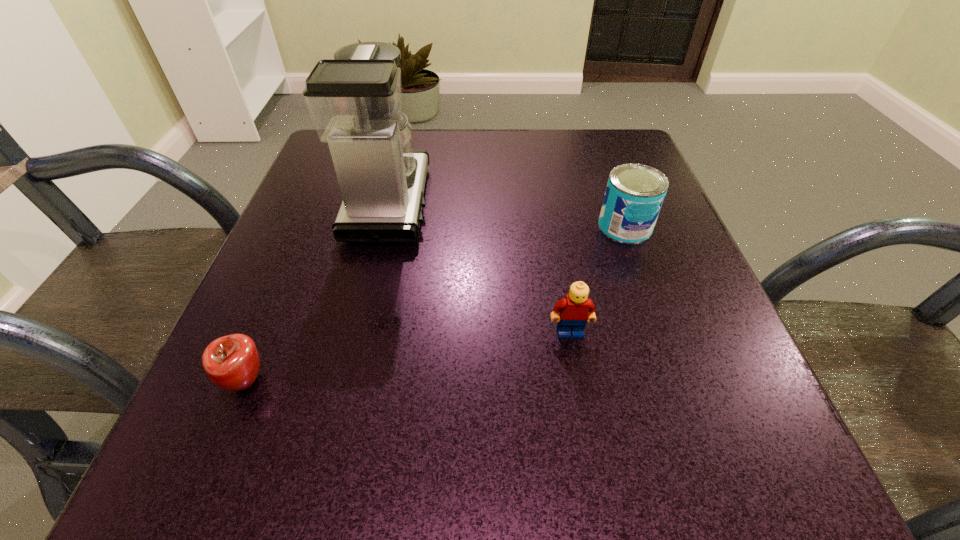
You are a GUI agent. You are given a task and a screenshot of the screen. Output one action in this format:
    pyautogui.click(x=<x>, y=<y>)
    Task: Click on the vacant space situated on the right of the leftmost object
    The height and width of the screenshot is (540, 960).
    Given the screenshot: What is the action you would take?
    pyautogui.click(x=399, y=381)

Where is `object that is at the far edge`? The width and height of the screenshot is (960, 540). object that is at the far edge is located at coordinates point(355,100).

The width and height of the screenshot is (960, 540). Identify the location of coffee maker that is at the left edge. (355, 100).

The image size is (960, 540). Find the location of `apple at the left edge`. apple at the left edge is located at coordinates (231, 362).

Where is `object present at the right edge`? The image size is (960, 540). object present at the right edge is located at coordinates (634, 195).

Locate an element on the screen. This screenshot has height=540, width=960. object present at the far left corner is located at coordinates (355, 100).

The image size is (960, 540). In order to click on blank area at the far edge in this screenshot , I will do `click(527, 134)`.

You are a GUI agent. You are given a task and a screenshot of the screen. Output one action in this format:
    pyautogui.click(x=<x>, y=<y>)
    Task: Click on the vacant region at the near edge
    Image resolution: width=960 pixels, height=540 pixels.
    Given the screenshot: What is the action you would take?
    pyautogui.click(x=359, y=456)

You are a GUI agent. You are given a task and a screenshot of the screen. Output one action in this format:
    pyautogui.click(x=<x>, y=<y>)
    Task: Click on the free point at the left edge
    
    Given the screenshot: What is the action you would take?
    pyautogui.click(x=325, y=322)

Locate an element on the screen. This screenshot has height=540, width=960. vacant region at the right edge of the desktop is located at coordinates (658, 243).